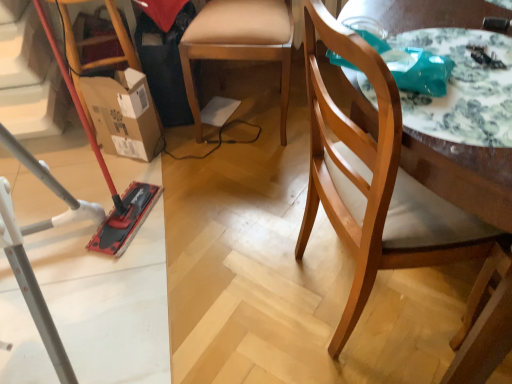
The width and height of the screenshot is (512, 384). I want to click on empty space that is to the right of cardboard box at left, so click(192, 158).